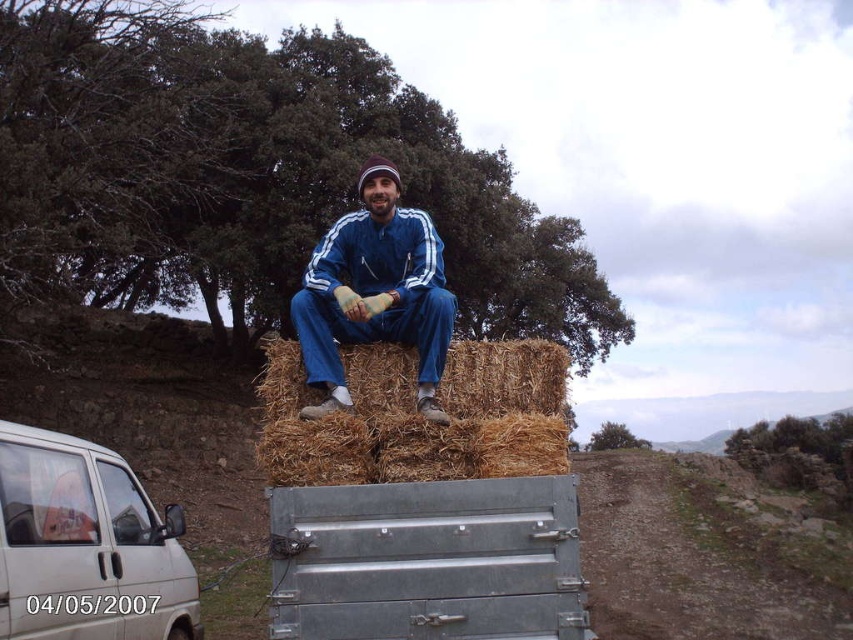
You are a delivery driver who needs to attach a new trailer to the back of your van. The trailer has a brown straw bale at upper center. The van is parked 12.46 feet away from the trailer. Can you safely attach the trailer within the 15 feet safety zone?

The distance between the van and the trailer with the brown straw bale at upper center is 12.46 feet, which is within the 15 feet safety zone. Therefore, you can safely attach the trailer.

You are a delivery driver who needs to place a new galvanized metal crate at center in the exact same location as the one shown in the image. What coordinates should you use to ensure it is placed correctly?

The galvanized metal crate at center should be placed at coordinates point (428,561) to match the image.